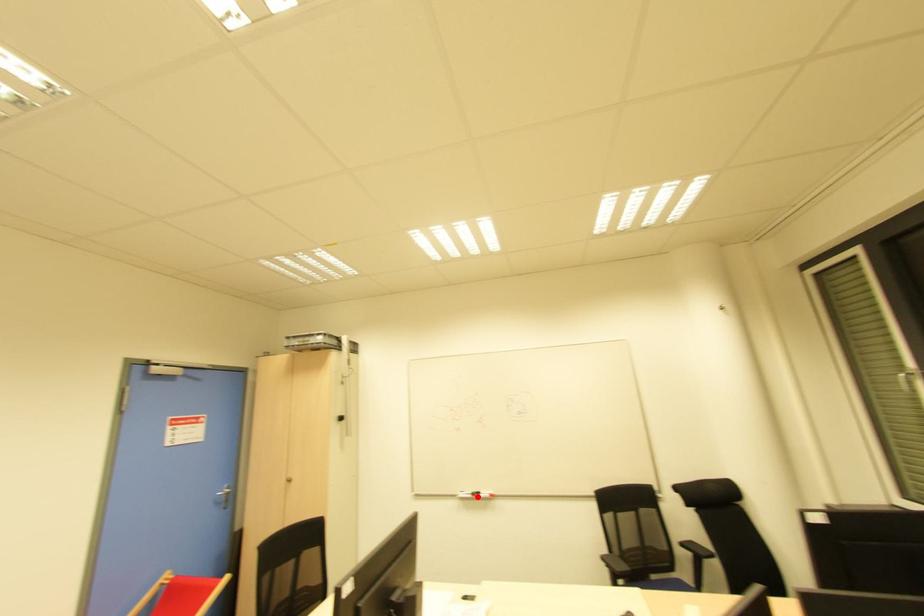
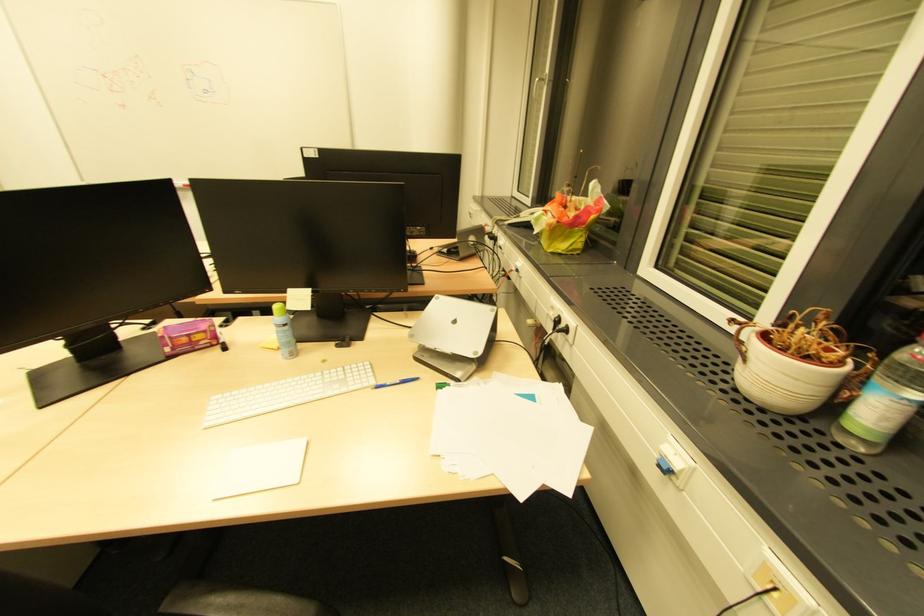
Question: I am providing you with two images of the same scene from different viewpoints. A red point is marked on the first image. Is the red point's position out of view in image 2?

Choices:
 (A) Yes
 (B) No

Answer: (A)